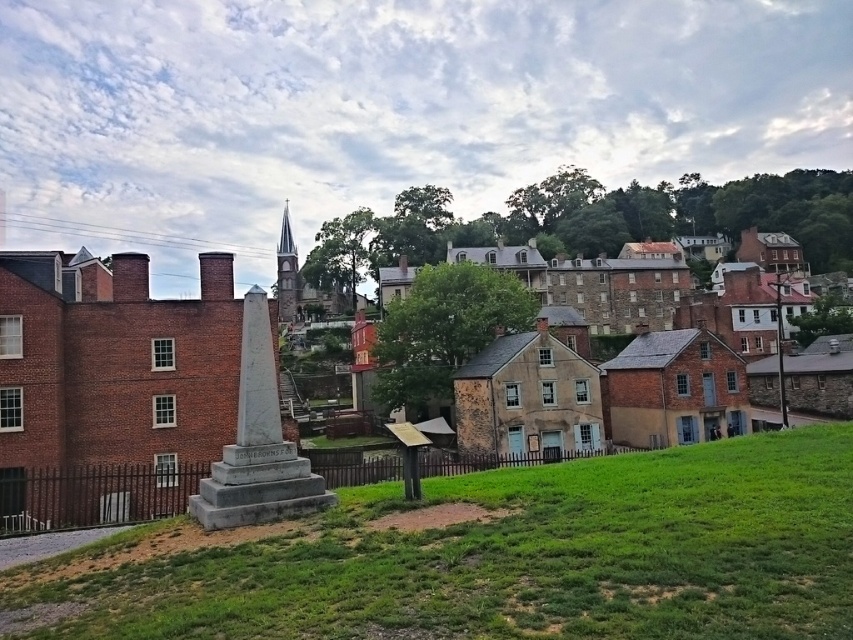
Question: Does gray marble obelisk at center have a larger size compared to smooth gray stone steeple at upper center?

Choices:
 (A) yes
 (B) no

Answer: (B)

Question: Which of the following is the farthest from the observer?

Choices:
 (A) (279, 493)
 (B) (213, 278)
 (C) (9, 470)

Answer: (B)

Question: Estimate the real-world distances between objects in this image. Which object is farther from the green grassy at center?

Choices:
 (A) gray stone monument at center
 (B) brick chimney at upper left
 (C) gray marble obelisk at center
 (D) smooth gray stone steeple at upper center

Answer: (D)

Question: Considering the relative positions of gray marble obelisk at center and brick chimney at upper left in the image provided, where is gray marble obelisk at center located with respect to brick chimney at upper left?

Choices:
 (A) above
 (B) below

Answer: (B)

Question: Based on their relative distances, which object is farther from the gray stone monument at center?

Choices:
 (A) brick chimney at upper left
 (B) green grassy at center

Answer: (A)

Question: Is gray marble obelisk at center wider than smooth gray stone steeple at upper center?

Choices:
 (A) no
 (B) yes

Answer: (A)